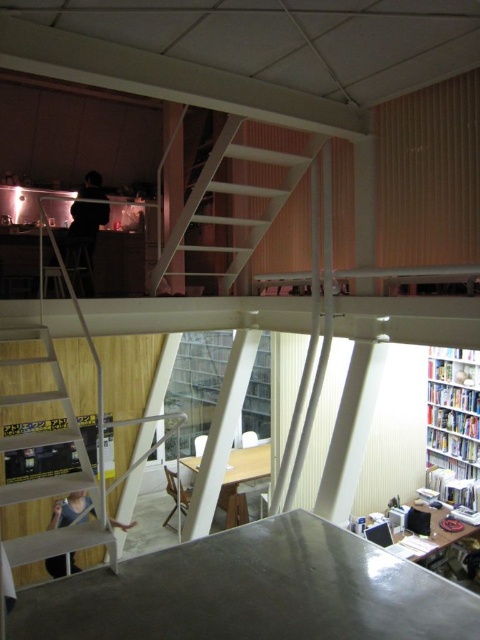
Can you confirm if white metal ladder at center is shorter than wooden staircase at lower left?

Incorrect, white metal ladder at center's height does not fall short of wooden staircase at lower left's.

Does point (290, 177) come in front of point (44, 332)?

No, it is not.

I want to click on white metal ladder at center, so click(x=233, y=202).

Between wooden staircase at lower left and white glossy bookshelf at right, which one is positioned lower?

white glossy bookshelf at right

Who is more distant from viewer, (10, 333) or (441, 368)?

The point (441, 368) is more distant.

Find the location of `wooden staircase at lower left`. wooden staircase at lower left is located at coordinates (52, 476).

Is white metal ladder at center above white glossy bookshelf at right?

Yes, white metal ladder at center is above white glossy bookshelf at right.

This screenshot has width=480, height=640. What do you see at coordinates (233, 202) in the screenshot? I see `white metal ladder at center` at bounding box center [233, 202].

Where is `white metal ladder at center`? Image resolution: width=480 pixels, height=640 pixels. white metal ladder at center is located at coordinates (233, 202).